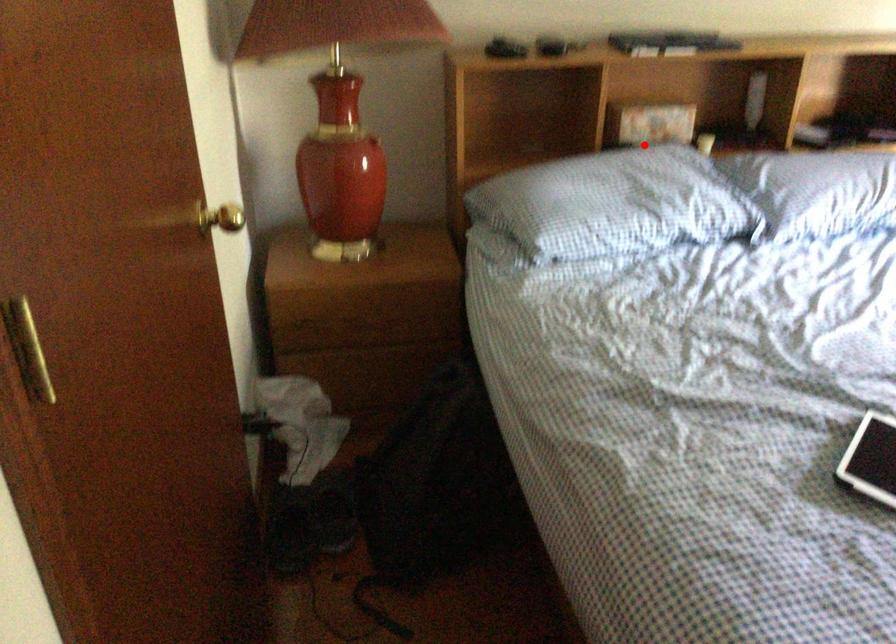
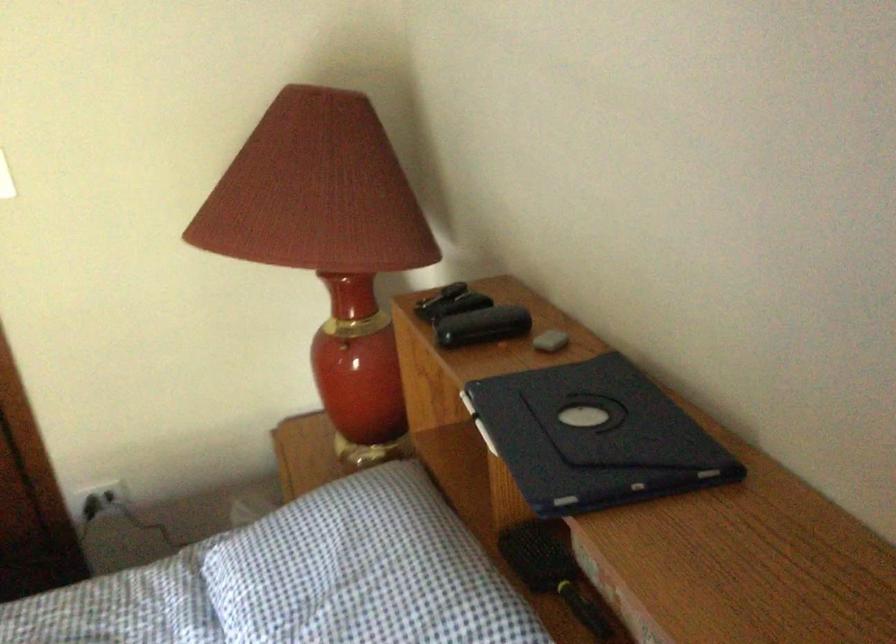
Question: I am providing you with two images of the same scene from different viewpoints. Image1 has a red point marked. In image2, the corresponding 3D location appears at what relative position? Reply with the corresponding letter.

Choices:
 (A) Closer
 (B) Farther

Answer: (A)